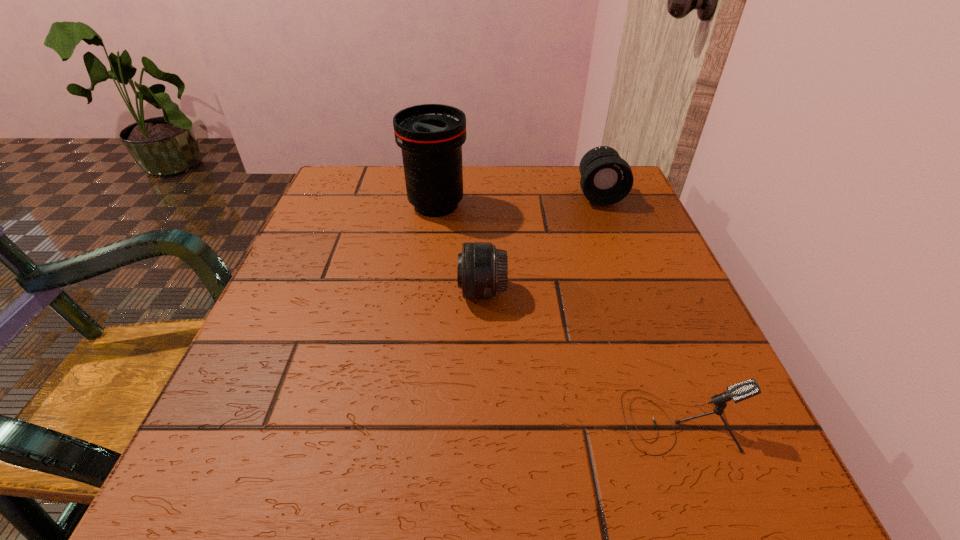
Where is `the tallest object`? the tallest object is located at coordinates (431, 136).

Locate an element on the screen. the rightmost telephoto lens is located at coordinates (606, 179).

Locate an element on the screen. the second nearest object is located at coordinates (482, 271).

Where is `microphone`? This screenshot has height=540, width=960. microphone is located at coordinates (738, 392).

The width and height of the screenshot is (960, 540). I want to click on vacant area situated 0.310m on the right of the tallest telephoto lens, so pos(604,205).

This screenshot has height=540, width=960. In order to click on free space located 0.090m at the front element of the rightmost telephoto lens in this screenshot , I will do `click(612, 231)`.

In order to click on vacant space located 0.170m on the front-facing side of the second nearest object in this screenshot , I will do `click(365, 292)`.

I want to click on vacant point located 0.250m on the front-facing side of the second nearest object, so click(x=320, y=292).

Identify the location of free location located 0.090m on the front-facing side of the second nearest object. (409, 292).

Image resolution: width=960 pixels, height=540 pixels. I want to click on free spot located on the stand of the nearest object, so click(354, 421).